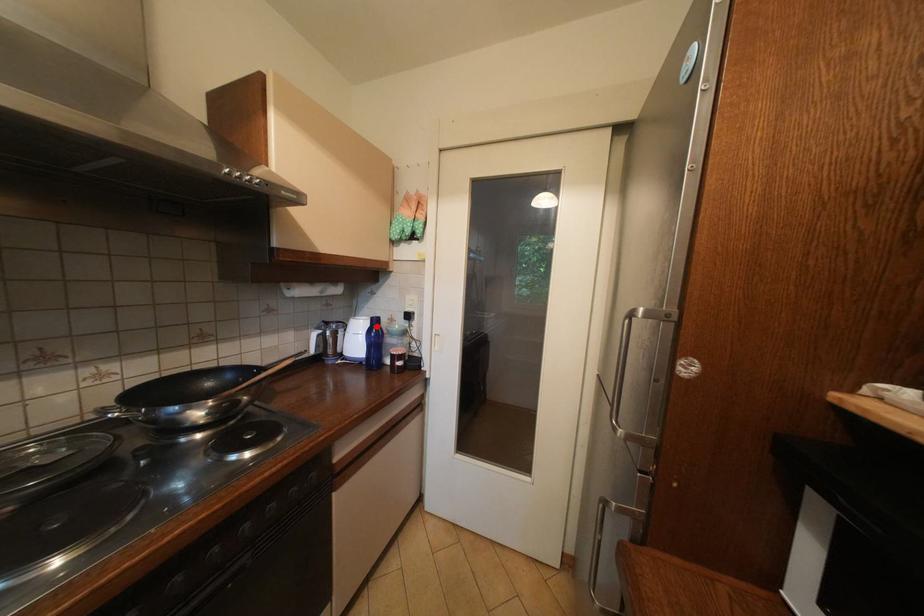
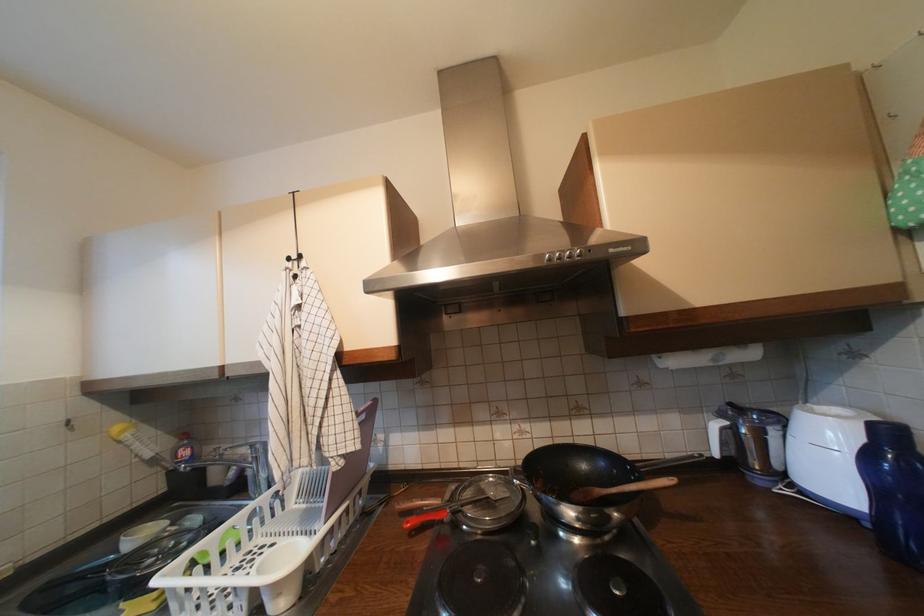
Question: I am providing you with two images of the same scene from different viewpoints. A red point is marked on the first image. Can you still see the location of the red point in image 2?

Choices:
 (A) Yes
 (B) No

Answer: (A)